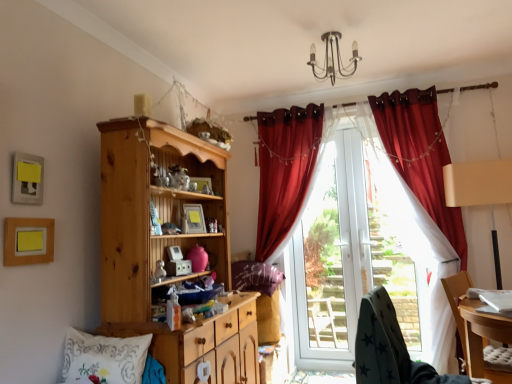
Question: Should I look upward or downward to see matte wooden picture frame at center, the 2th picture frame viewed from the right?

Choices:
 (A) down
 (B) up

Answer: (A)

Question: Is the position of dark grey fabric chair at lower right, arranged as the 1th chair when viewed from the left, more distant than that of white embroidered pillow at lower left, the 1th pillow from the left?

Choices:
 (A) yes
 (B) no

Answer: (B)

Question: Considering the relative positions of dark grey fabric chair at lower right, arranged as the 1th chair when viewed from the left, and white embroidered pillow at lower left, the 2th pillow viewed from the back, in the image provided, is dark grey fabric chair at lower right, arranged as the 1th chair when viewed from the left, to the right of white embroidered pillow at lower left, the 2th pillow viewed from the back, from the viewer's perspective?

Choices:
 (A) no
 (B) yes

Answer: (B)

Question: Does dark grey fabric chair at lower right, arranged as the 1th chair when viewed from the left, have a smaller size compared to white embroidered pillow at lower left, the second pillow positioned from the right?

Choices:
 (A) no
 (B) yes

Answer: (A)

Question: Is white embroidered pillow at lower left, the 1th pillow when ordered from front to back, surrounded by dark grey fabric chair at lower right, arranged as the 1th chair when viewed from the left?

Choices:
 (A) no
 (B) yes

Answer: (A)

Question: From a real-world perspective, is dark grey fabric chair at lower right, arranged as the 1th chair when viewed from the left, positioned under white embroidered pillow at lower left, the 1th pillow when ordered from front to back, based on gravity?

Choices:
 (A) yes
 (B) no

Answer: (A)

Question: Is dark grey fabric chair at lower right, arranged as the 1th chair when viewed from the left, looking in the opposite direction of white embroidered pillow at lower left, the 1th pillow when ordered from front to back?

Choices:
 (A) no
 (B) yes

Answer: (A)

Question: Is wooden chair at lower right, which appears as the second chair when viewed from the left, closer to the viewer compared to wooden picture frame at upper center, the 4th picture frame when ordered from front to back?

Choices:
 (A) yes
 (B) no

Answer: (A)

Question: Is wooden chair at lower right, the 1th chair in the right-to-left sequence, looking in the opposite direction of wooden picture frame at upper center, which is counted as the 1th picture frame, starting from the back?

Choices:
 (A) no
 (B) yes

Answer: (A)

Question: Is wooden chair at lower right, the 1th chair in the right-to-left sequence, next to wooden picture frame at upper center, the 4th picture frame when ordered from front to back, and touching it?

Choices:
 (A) no
 (B) yes

Answer: (A)

Question: From a real-world perspective, is wooden chair at lower right, the 1th chair in the right-to-left sequence, located beneath wooden picture frame at upper center, which is counted as the 1th picture frame, starting from the back?

Choices:
 (A) yes
 (B) no

Answer: (A)

Question: Does wooden chair at lower right, which appears as the second chair when viewed from the left, have a lesser width compared to wooden picture frame at upper center, the 4th picture frame when ordered from front to back?

Choices:
 (A) yes
 (B) no

Answer: (B)

Question: Considering the relative sizes of wooden chair at lower right, the 1th chair in the right-to-left sequence, and wooden picture frame at upper center, which is the fourth picture frame from left to right, in the image provided, is wooden chair at lower right, the 1th chair in the right-to-left sequence, smaller than wooden picture frame at upper center, which is the fourth picture frame from left to right,?

Choices:
 (A) yes
 (B) no

Answer: (B)

Question: Is white embroidered pillow at lower left, the 1th pillow when ordered from front to back, located outside matte yellow picture frame at upper left, marked as the 2th picture frame in a front-to-back arrangement?

Choices:
 (A) no
 (B) yes

Answer: (B)